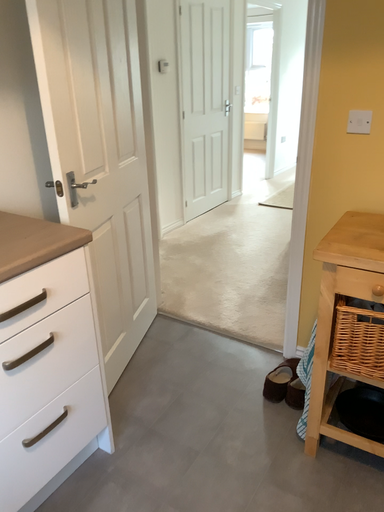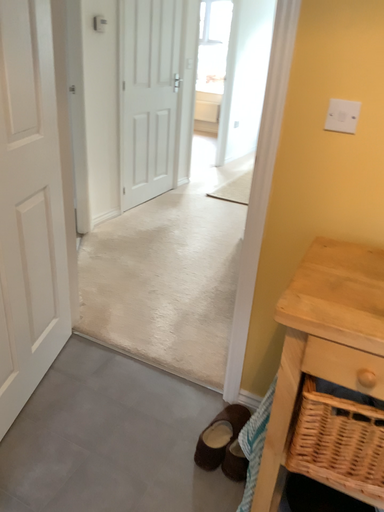
Question: How did the camera likely rotate when shooting the video?

Choices:
 (A) rotated left
 (B) rotated right

Answer: (B)